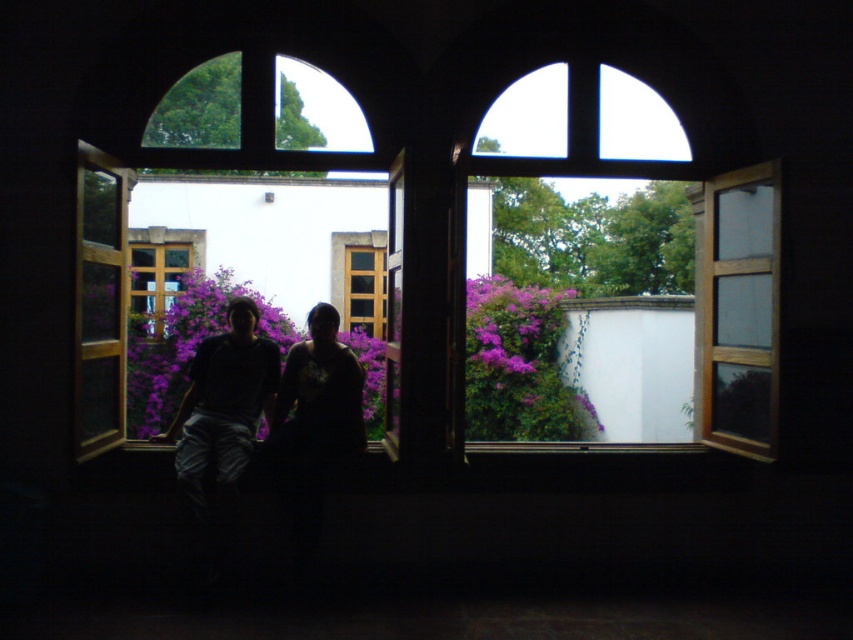
Between transparent glass window at center and dark clothing at center, which one is positioned higher?

Positioned higher is transparent glass window at center.

Does transparent glass window at center have a larger size compared to dark clothing at center?

Yes, transparent glass window at center is bigger than dark clothing at center.

Is point (459, 269) positioned behind point (299, 378)?

No, it is in front of (299, 378).

Find the location of a particular element. The height and width of the screenshot is (640, 853). transparent glass window at center is located at coordinates (463, 186).

Measure the distance between transparent glass window at center and camera.

A distance of 4.96 meters exists between transparent glass window at center and camera.

Between point (422, 216) and point (200, 339), which one is positioned behind?

Positioned behind is point (200, 339).

Is point (157, 150) less distant than point (519, 356)?

Yes, point (157, 150) is closer to viewer.

Where is `transparent glass window at center`? transparent glass window at center is located at coordinates (463, 186).

Between point (469, 292) and point (271, 348), which one is positioned in front?

Point (271, 348) is in front.

Who is shorter, purple matte flowers at center or dark clothing at center?

Standing shorter between the two is purple matte flowers at center.

From the picture: Who is more forward, [490,396] or [207,461]?

Positioned in front is point [207,461].

This screenshot has height=640, width=853. Identify the location of purple matte flowers at center. (520, 365).